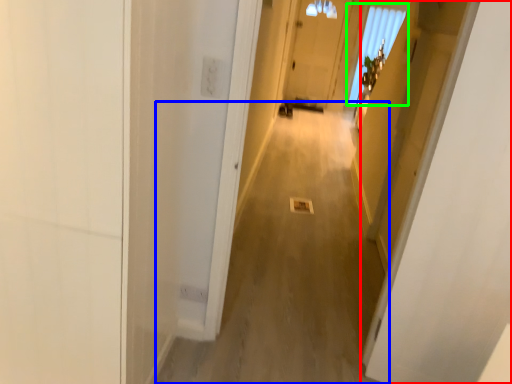
Question: Estimate the real-world distances between objects in this image. Which object is closer to door (highlighted by a red box), alley (highlighted by a blue box) or window (highlighted by a green box)?

Choices:
 (A) alley
 (B) window

Answer: (A)